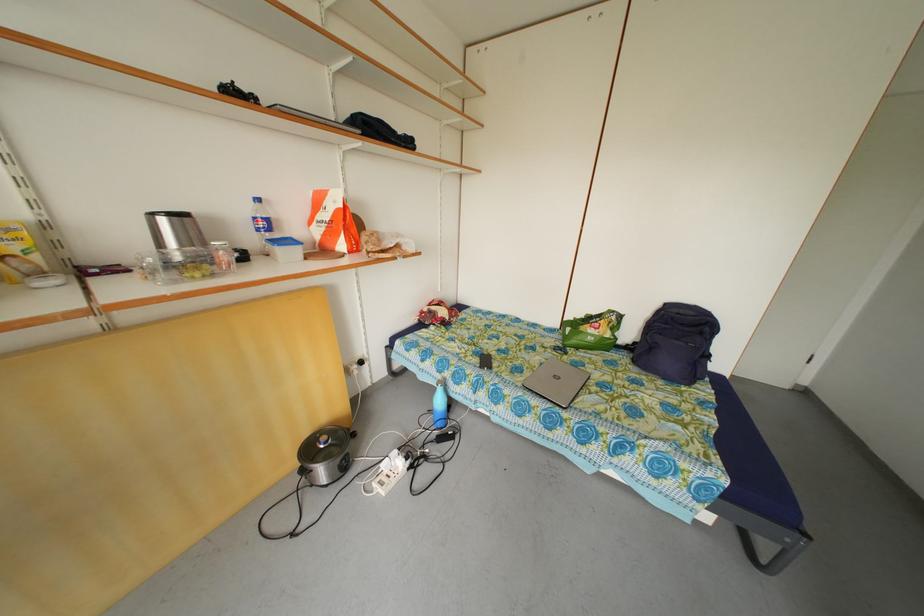
Which object does [555,381] point to?

It refers to a laptop.